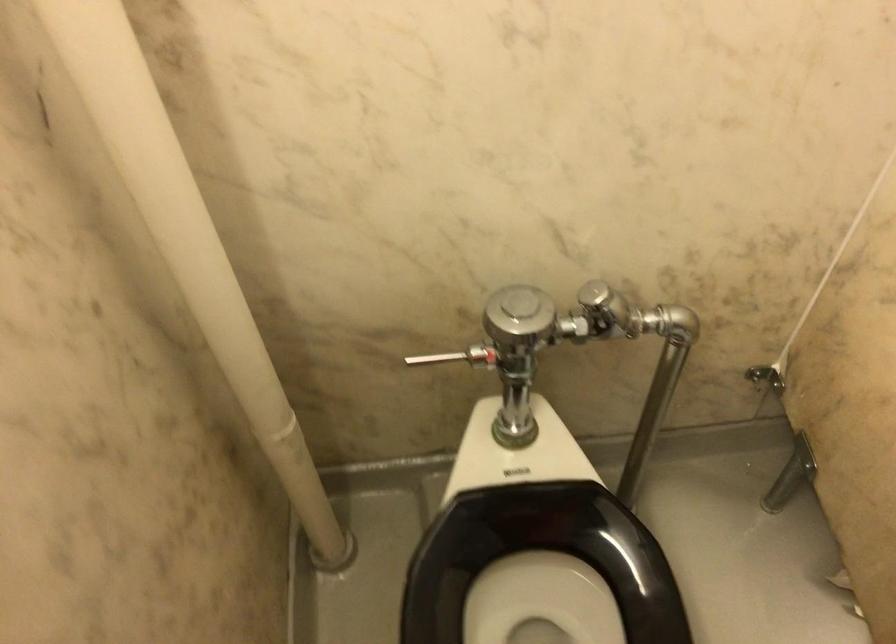
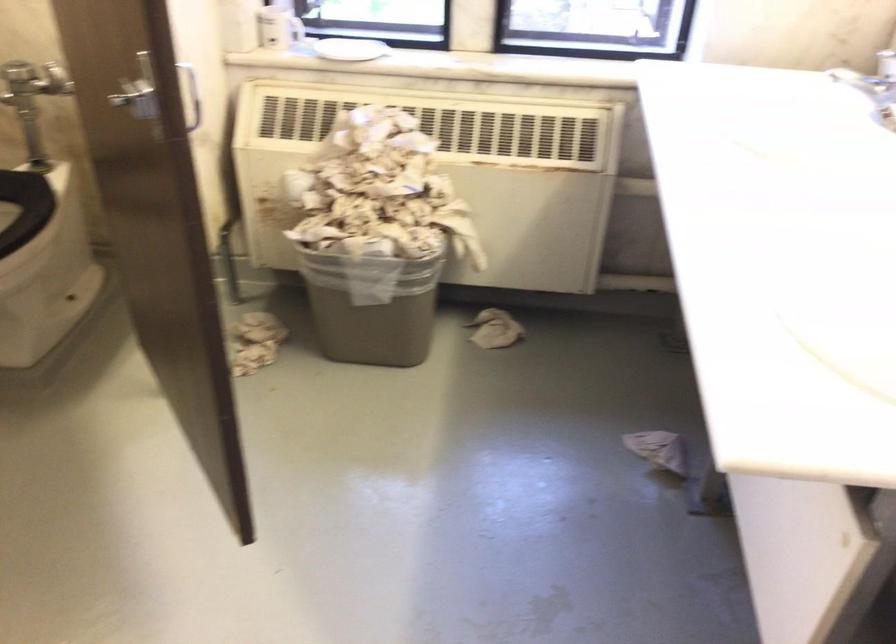
Find the pixel in the second image that matches pixel 552 330 in the first image.

(32, 80)